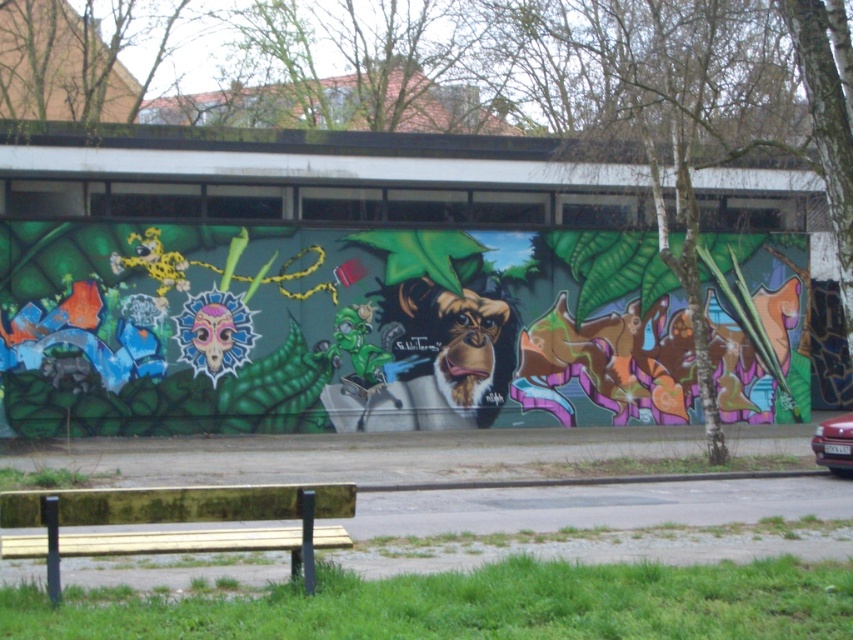
Question: Can you confirm if wooden bench at lower left is positioned to the left of shiny red car at right?

Choices:
 (A) no
 (B) yes

Answer: (B)

Question: Among these objects, which one is farthest from the camera?

Choices:
 (A) wooden bench at lower left
 (B) shiny red car at right

Answer: (B)

Question: Can you confirm if wooden bench at lower left is positioned to the right of shiny red car at right?

Choices:
 (A) no
 (B) yes

Answer: (A)

Question: Which point is farther to the camera?

Choices:
 (A) wooden bench at lower left
 (B) shiny red car at right

Answer: (B)

Question: Does wooden bench at lower left appear on the right side of shiny red car at right?

Choices:
 (A) no
 (B) yes

Answer: (A)